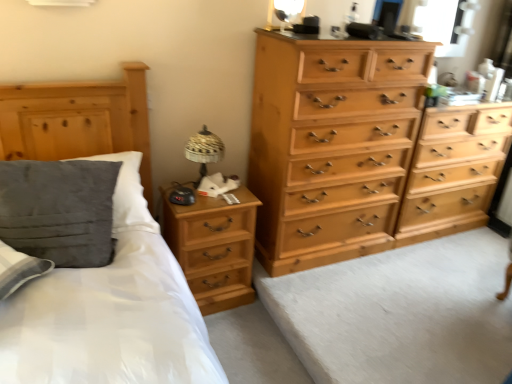
Question: From a real-world perspective, is transparent glass window at upper right physically below light wood chest of drawers at center right, marked as the 1th chest of drawers in a right-to-left arrangement?

Choices:
 (A) no
 (B) yes

Answer: (A)

Question: Is transparent glass window at upper right positioned before light wood chest of drawers at center right, positioned as the second chest of drawers in left-to-right order?

Choices:
 (A) yes
 (B) no

Answer: (B)

Question: Does transparent glass window at upper right have a larger size compared to light wood chest of drawers at center right, marked as the 1th chest of drawers in a right-to-left arrangement?

Choices:
 (A) yes
 (B) no

Answer: (B)

Question: Is transparent glass window at upper right oriented towards light wood chest of drawers at center right, positioned as the second chest of drawers in left-to-right order?

Choices:
 (A) yes
 (B) no

Answer: (B)

Question: Considering the relative positions of transparent glass window at upper right and light wood chest of drawers at center right, positioned as the second chest of drawers in left-to-right order, in the image provided, is transparent glass window at upper right to the right of light wood chest of drawers at center right, positioned as the second chest of drawers in left-to-right order, from the viewer's perspective?

Choices:
 (A) no
 (B) yes

Answer: (A)

Question: Are transparent glass window at upper right and light wood chest of drawers at center right, marked as the 1th chest of drawers in a right-to-left arrangement, located far from each other?

Choices:
 (A) yes
 (B) no

Answer: (A)

Question: Does matte gold table lamp at upper center, the second table lamp in the bottom-to-top sequence, have a larger size compared to light wood chest of drawers at center right, marked as the 1th chest of drawers in a right-to-left arrangement?

Choices:
 (A) no
 (B) yes

Answer: (A)

Question: Does matte gold table lamp at upper center, the second table lamp in the bottom-to-top sequence, touch light wood chest of drawers at center right, marked as the 1th chest of drawers in a right-to-left arrangement?

Choices:
 (A) yes
 (B) no

Answer: (B)

Question: Can you confirm if matte gold table lamp at upper center, marked as the first table lamp in a right-to-left arrangement, is thinner than light wood chest of drawers at center right, positioned as the second chest of drawers in left-to-right order?

Choices:
 (A) yes
 (B) no

Answer: (A)

Question: Is matte gold table lamp at upper center, marked as the first table lamp in a right-to-left arrangement, shorter than light wood chest of drawers at center right, positioned as the second chest of drawers in left-to-right order?

Choices:
 (A) yes
 (B) no

Answer: (A)

Question: Can you confirm if matte gold table lamp at upper center, the second table lamp when ordered from left to right, is positioned to the right of light wood chest of drawers at center right, positioned as the second chest of drawers in left-to-right order?

Choices:
 (A) yes
 (B) no

Answer: (B)

Question: From the image's perspective, is matte gold table lamp at upper center, marked as the first table lamp in a right-to-left arrangement, beneath light wood chest of drawers at center right, positioned as the second chest of drawers in left-to-right order?

Choices:
 (A) no
 (B) yes

Answer: (A)

Question: Can you confirm if velvety gray pillow at left is taller than transparent glass window at upper right?

Choices:
 (A) no
 (B) yes

Answer: (B)